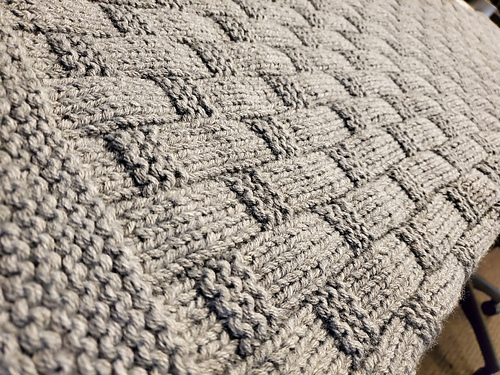
Identify every occurrence of where you would walk on the rug in the image. Your answer should be formatted as a list of tuples, i.e. [(x1, y1), (x2, y2), ...], where each tuple contains the x and y coordinates of a point satisfying the conditions above.

[(244, 166)]